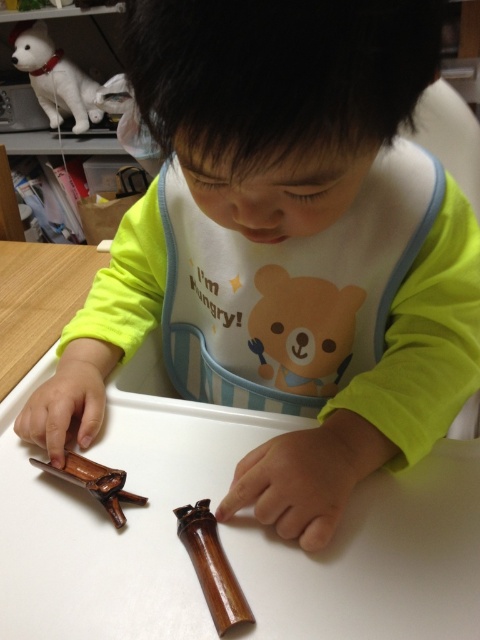
You are a parent trying to choose a toy for your child to play with. You see the white glossy dog at upper left and the brown polished wooden stick at center. Which toy is taller?

The white glossy dog at upper left is much taller than the brown polished wooden stick at center, so the white glossy dog at upper left is the taller toy.

You are a parent trying to choose a toy for your child to play with. The child is currently looking at the white glossy dog at upper left and the brown polished wooden stick at center. Based on their sizes, which one do you think the child might find easier to hold and play with?

The white glossy dog at upper left has a larger size compared to the brown polished wooden stick at center, so the child might find it easier to hold and play with the white glossy dog at upper left due to its bigger size.